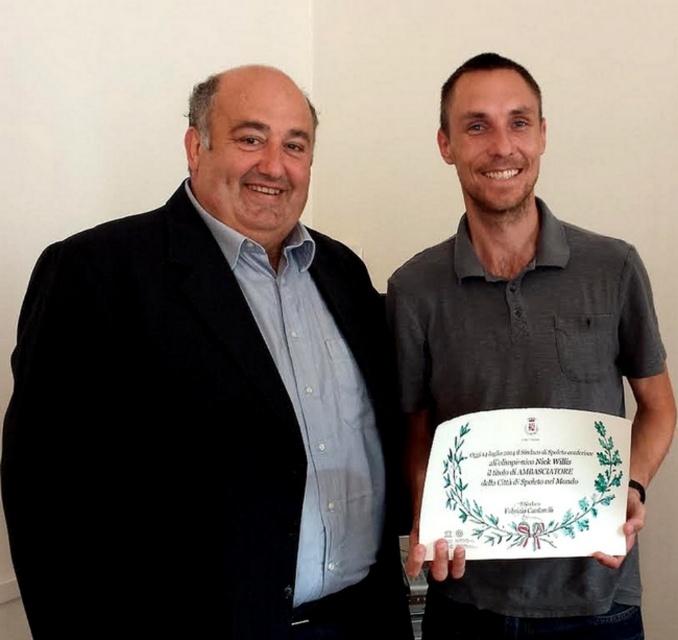
Is matte black suit at left shorter than gray cotton polo shirt at center?

Yes, matte black suit at left is shorter than gray cotton polo shirt at center.

Does matte black suit at left have a greater width compared to gray cotton polo shirt at center?

Yes, matte black suit at left is wider than gray cotton polo shirt at center.

This screenshot has height=640, width=678. What do you see at coordinates (193, 401) in the screenshot?
I see `matte black suit at left` at bounding box center [193, 401].

This screenshot has width=678, height=640. I want to click on matte black suit at left, so click(193, 401).